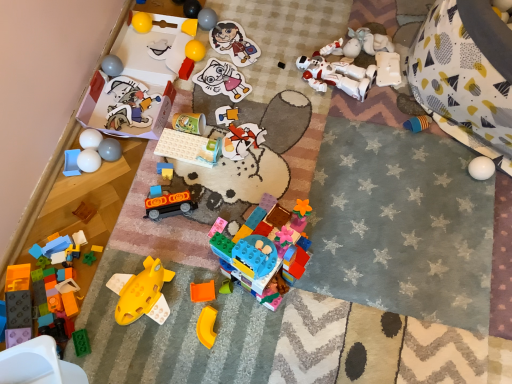
Image resolution: width=512 pixels, height=384 pixels. I want to click on vacant point to the right of matte gray ball at upper left, acting as the 7th toy starting from the left, so click(159, 156).